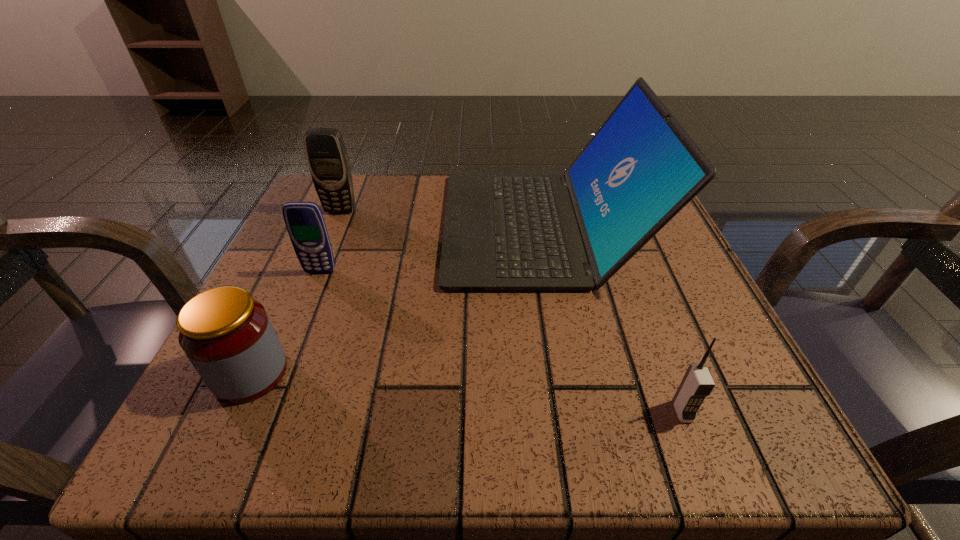
The height and width of the screenshot is (540, 960). What are the coordinates of `the closest cellular telephone relative to the second farthest cellular telephone` in the screenshot? It's located at (328, 161).

Locate which cellular telephone is the second closest to the second farthest cellular telephone. Please provide its 2D coordinates. Your answer should be formatted as a tuple, i.e. [(x, y)], where the tuple contains the x and y coordinates of a point satisfying the conditions above.

[(697, 383)]

The image size is (960, 540). I want to click on vacant space that satisfies the following two spatial constraints: 1. on the screen of the tallest object; 2. on the front side of the jar, so click(570, 373).